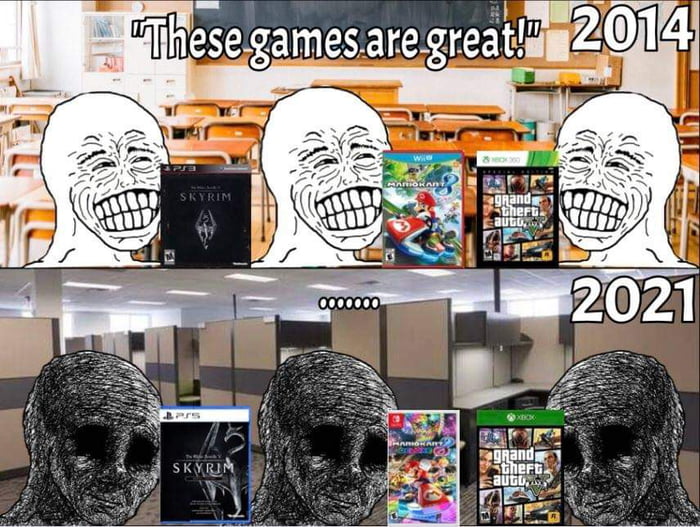
The width and height of the screenshot is (700, 527). I want to click on ceiling, so click(141, 295).